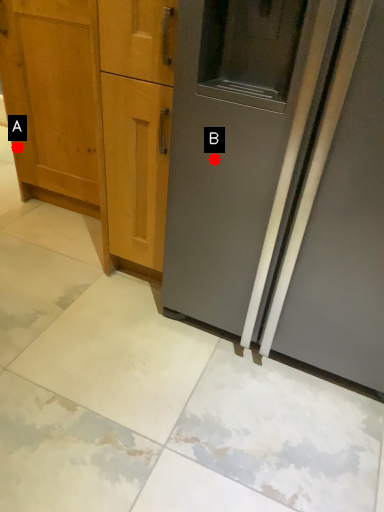
Question: Two points are circled on the image, labeled by A and B beside each circle. Which of the following is the farthest from the observer?

Choices:
 (A) A is further
 (B) B is further

Answer: (A)